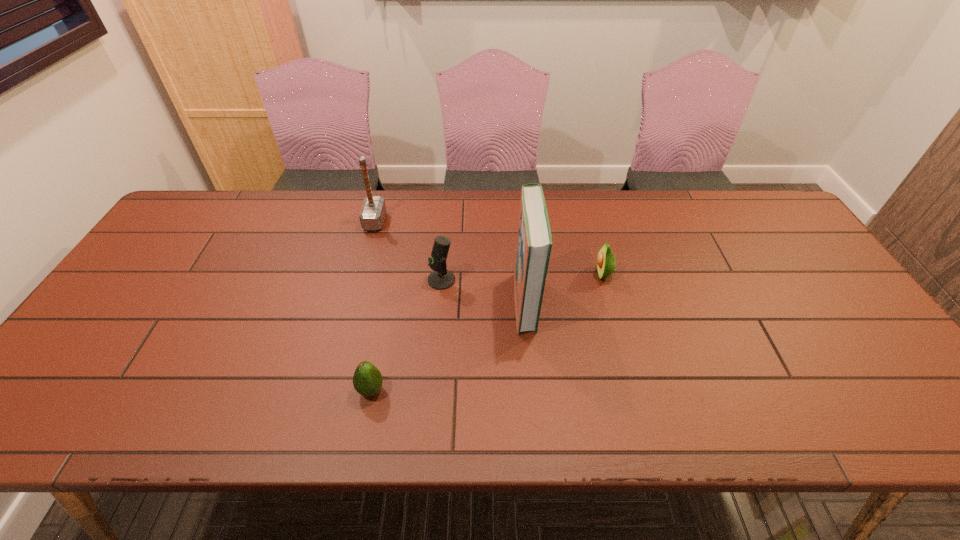
Find the location of a particular element. This screenshot has height=540, width=960. free point between the farther avocado and the second object from left to right is located at coordinates (487, 332).

Identify the location of empty space that is in between the farthest object and the farther avocado. This screenshot has width=960, height=540. (489, 247).

Find the location of a particular element. The image size is (960, 540). vacant area that lies between the second shortest object and the leftmost object is located at coordinates (489, 247).

Identify the location of blank region between the microphone and the farthest object. (x=408, y=251).

Where is `vacant space that is in between the fourth object from left to right and the rightmost object`? vacant space that is in between the fourth object from left to right and the rightmost object is located at coordinates (564, 288).

Find the location of a particular element. This screenshot has width=960, height=540. free space that is in between the second object from right to left and the nearest object is located at coordinates (448, 346).

Identify the location of the closest object to the microphone. This screenshot has height=540, width=960. (534, 243).

Locate which object is the fourth closest to the third object from left to right. Please provide its 2D coordinates. Your answer should be formatted as a tuple, i.e. [(x, y)], where the tuple contains the x and y coordinates of a point satisfying the conditions above.

[(606, 262)]

You are a GUI agent. You are given a task and a screenshot of the screen. Output one action in this format:
    pyautogui.click(x=<x>, y=<y>)
    Task: Click on the free space that satisfies the following two spatial constraints: 1. on the cut side of the right avocado; 2. on the front side of the nearer avocado
    Image resolution: width=960 pixels, height=540 pixels.
    Given the screenshot: What is the action you would take?
    [x=635, y=390]

The image size is (960, 540). Identify the location of vacant space that satisfies the following two spatial constraints: 1. on the striking surface of the hammer; 2. on the right side of the second object from left to right. tap(331, 390).